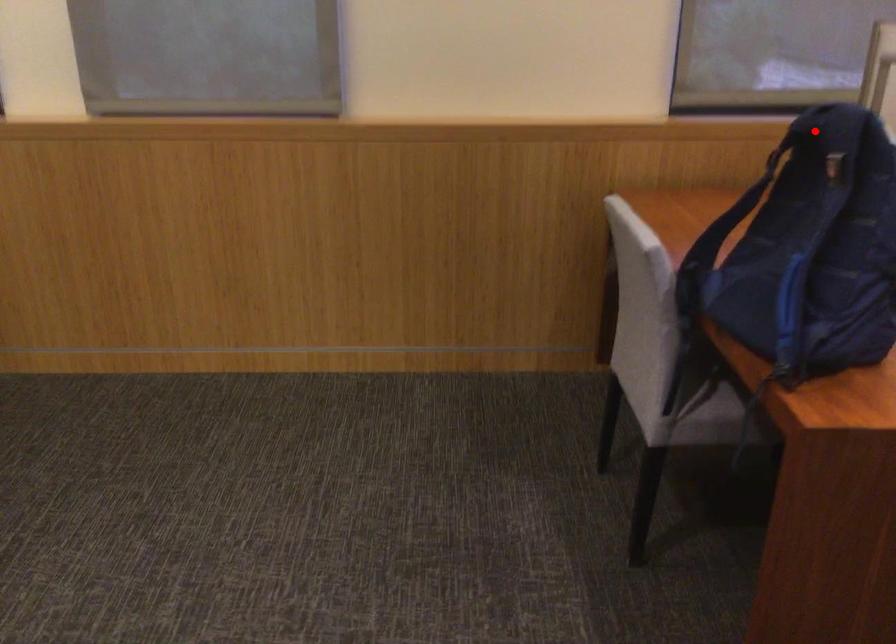
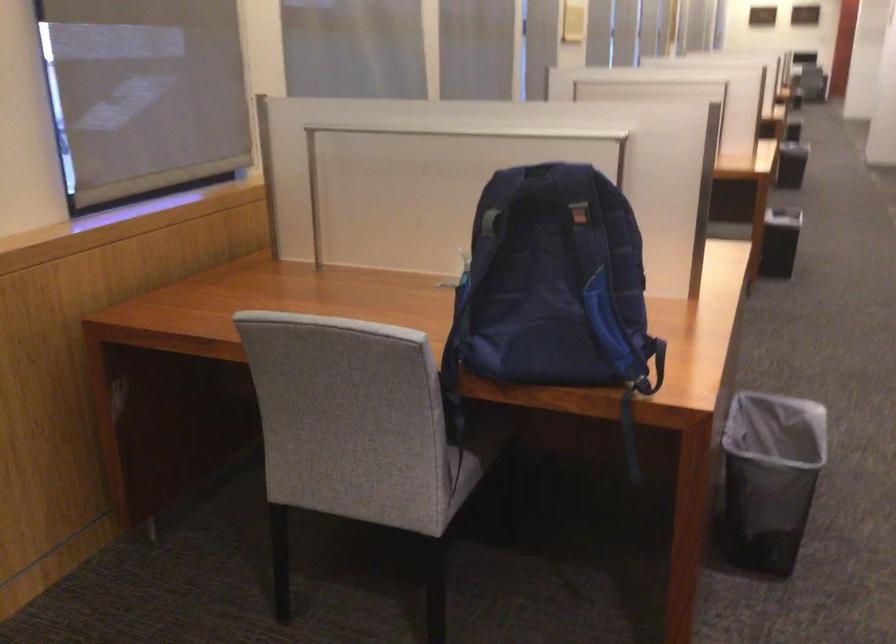
The point at the highlighted location is marked in the first image. Where is the corresponding point in the second image?

(538, 184)